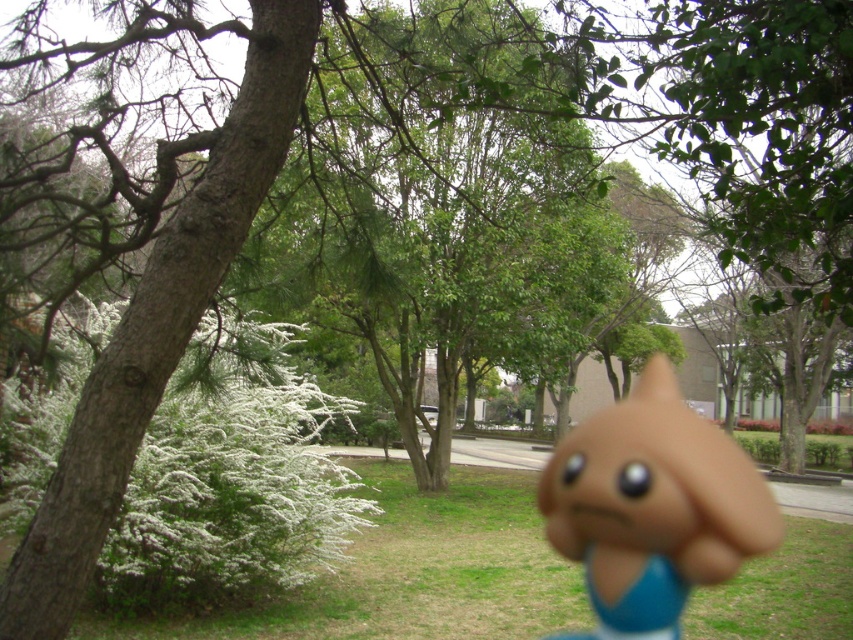
Is green grass at lower left thinner than brown rubber toy at center?

Yes, green grass at lower left is thinner than brown rubber toy at center.

Does point (354, 468) lie behind point (618, 636)?

Yes, point (354, 468) is behind point (618, 636).

You are a GUI agent. You are given a task and a screenshot of the screen. Output one action in this format:
    pyautogui.click(x=<x>, y=<y>)
    Task: Click on the green grass at lower left
    
    Given the screenshot: What is the action you would take?
    pyautogui.click(x=410, y=572)